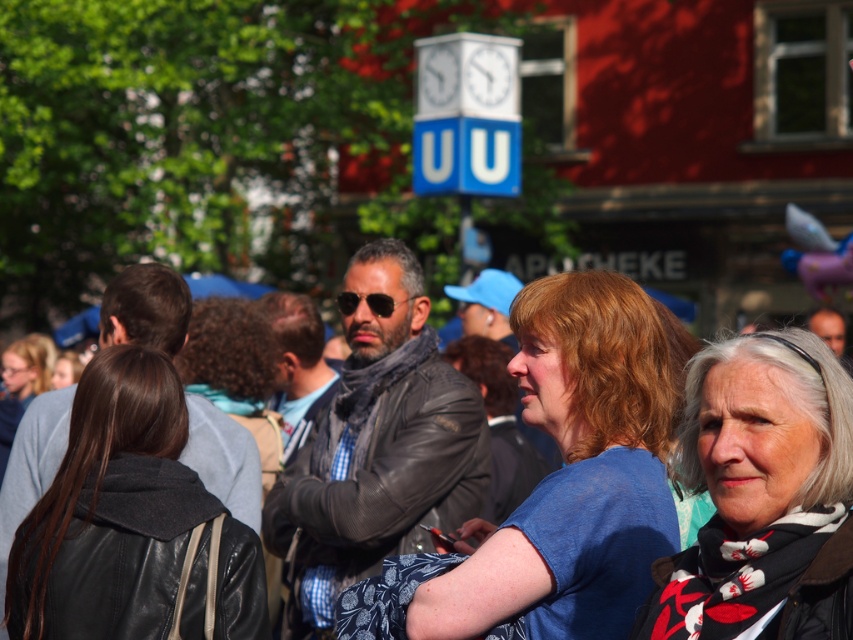
You are a photographer trying to capture a clear shot of both the white printed scarf at center and the leather jacket at center. Since you want to focus on the scarf first, which object should you adjust your camera focus on first?

The white printed scarf at center is positioned under the leather jacket at center, so you should focus on the leather jacket at center first to ensure the scarf is in the same focal plane.

You are a photographer taking a picture of the crowd at the event. You notice the blue fabric shirt at center and the white printed scarf at center. Which object is closer to the camera?

The blue fabric shirt at center is closer to the camera because the white printed scarf at center is behind it.

You are standing in the crowd at the event and want to hand a flyer to the person wearing the blue fabric shirt at center and the leather jacket at center. Which one can you reach first without moving from your spot?

The blue fabric shirt at center is closer to the viewer than the leather jacket at center, so you can reach the person wearing the blue fabric shirt at center first without moving.